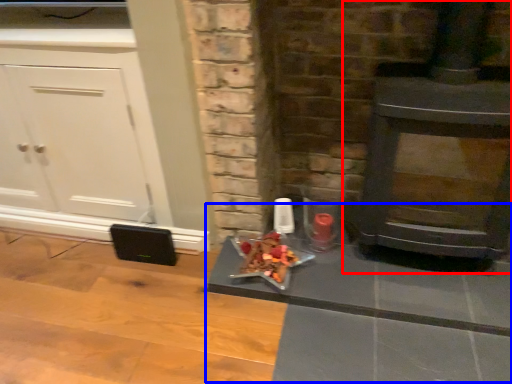
Question: Which point is further to the camera, wood burning stove (highlighted by a red box) or table (highlighted by a blue box)?

Choices:
 (A) wood burning stove
 (B) table

Answer: (B)